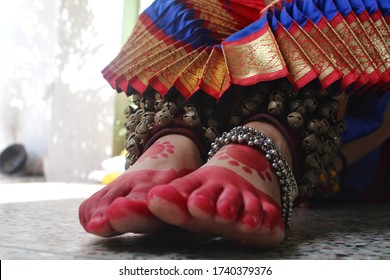
Locate an element on the screen. The width and height of the screenshot is (390, 280). multi colored floor is located at coordinates (346, 236), (56, 225), (327, 240).